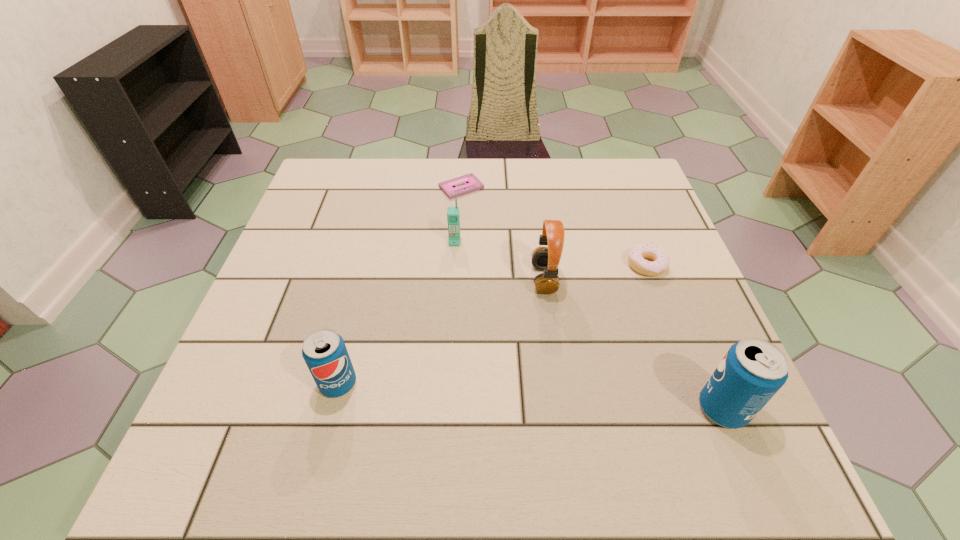
To make them evenly spaced by inserting another pop_(soda) among them, please locate a free space for this new pop_(soda). Please provide its 2D coordinates. Your answer should be formatted as a tuple, i.e. [(x, y)], where the tuple contains the x and y coordinates of a point satisfying the conditions above.

[(526, 396)]